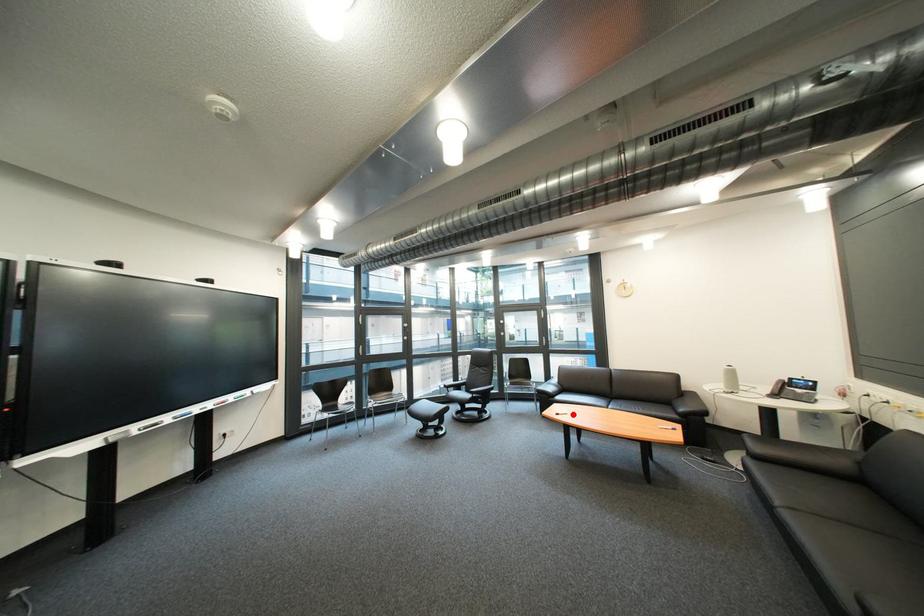
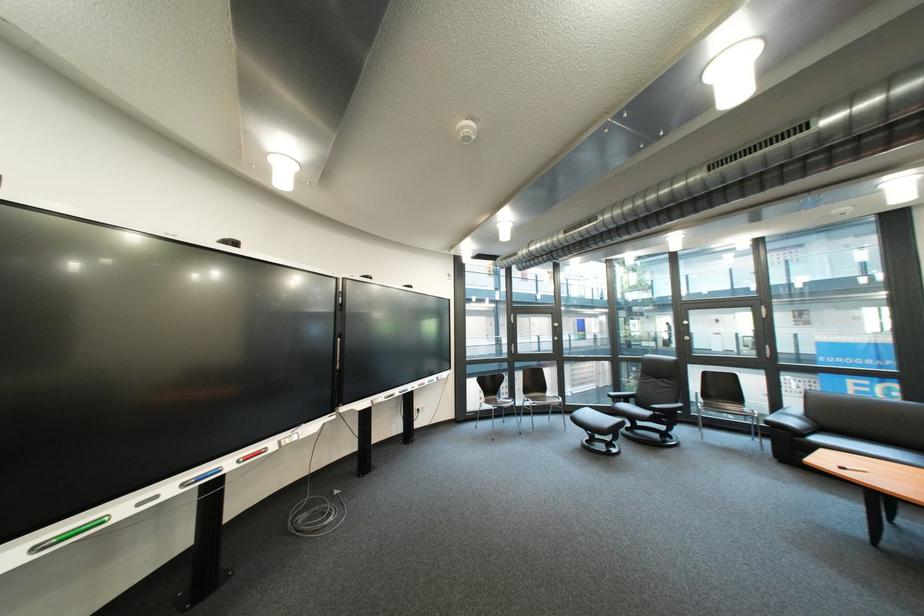
Find the pixel in the second image that matches the highlighted location in the first image.

(862, 469)